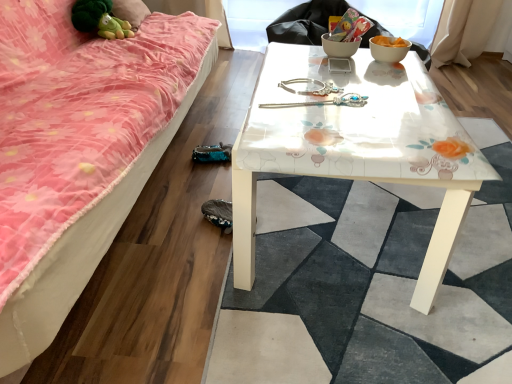
Locate an element on the screen. Image resolution: width=512 pixels, height=384 pixels. free space in front of silver metallic hairpin at center is located at coordinates (321, 128).